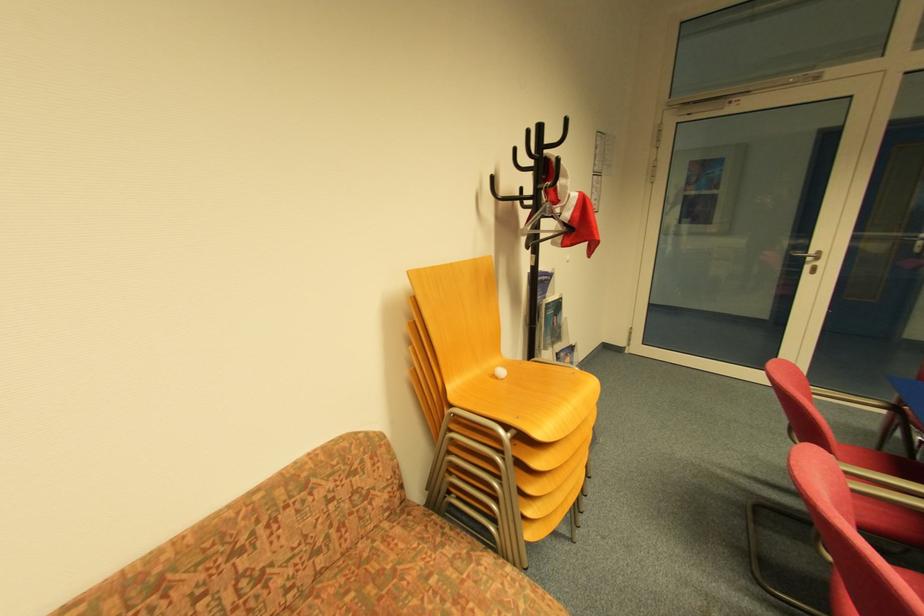
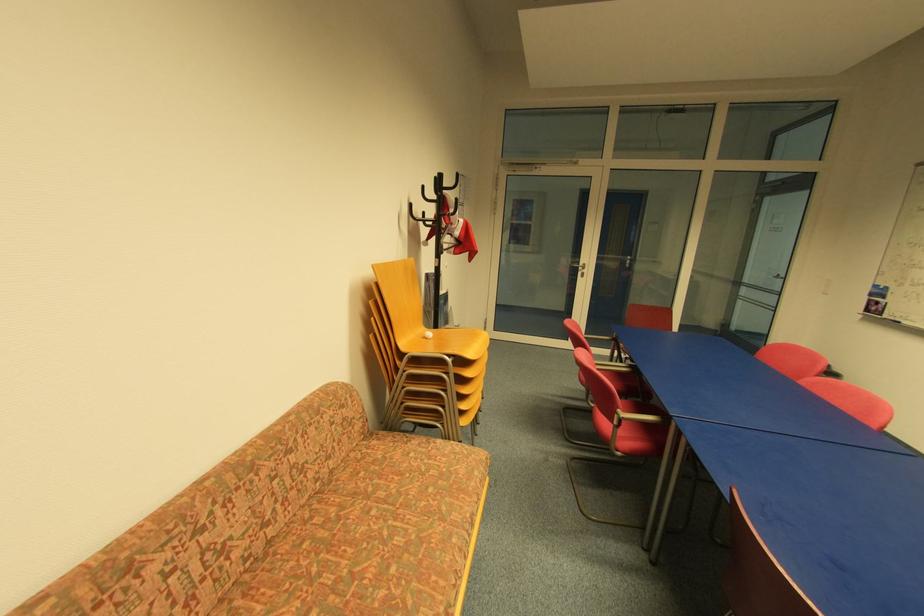
Where in the second image is the point corresponding to point (808, 259) from the first image?

(581, 269)